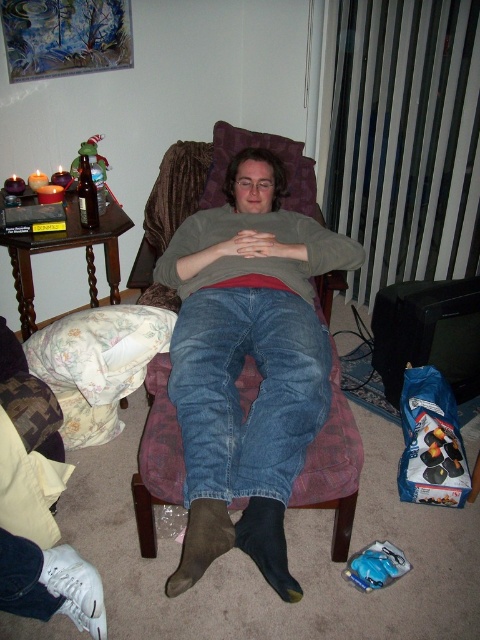
Can you confirm if denim jeans at center is positioned above purple fabric armchair at center?

Correct, denim jeans at center is located above purple fabric armchair at center.

Can you confirm if denim jeans at center is positioned below purple fabric armchair at center?

No, denim jeans at center is not below purple fabric armchair at center.

Find the location of a particular element. The width and height of the screenshot is (480, 640). denim jeans at center is located at coordinates (238, 394).